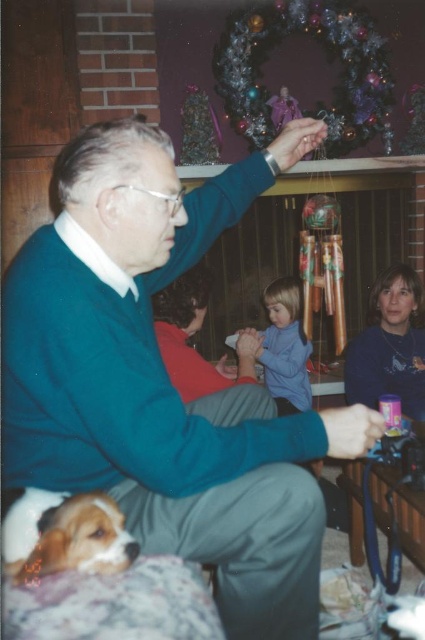
Question: Which object is positioned closest to the brown fur dog at lower left?

Choices:
 (A) green sweater at center
 (B) blue smooth shirt at center

Answer: (A)

Question: Which object is positioned farthest from the brown fur dog at lower left?

Choices:
 (A) blue smooth shirt at center
 (B) green sweater at center

Answer: (A)

Question: Considering the relative positions of green sweater at center and blue smooth shirt at center in the image provided, where is green sweater at center located with respect to blue smooth shirt at center?

Choices:
 (A) right
 (B) left

Answer: (B)

Question: Which object appears farthest from the camera in this image?

Choices:
 (A) blue smooth shirt at center
 (B) green sweater at center
 (C) brown fur dog at lower left

Answer: (A)

Question: Can you confirm if green sweater at center is wider than brown fur dog at lower left?

Choices:
 (A) no
 (B) yes

Answer: (B)

Question: Does brown fur dog at lower left appear on the left side of blue smooth shirt at center?

Choices:
 (A) no
 (B) yes

Answer: (B)